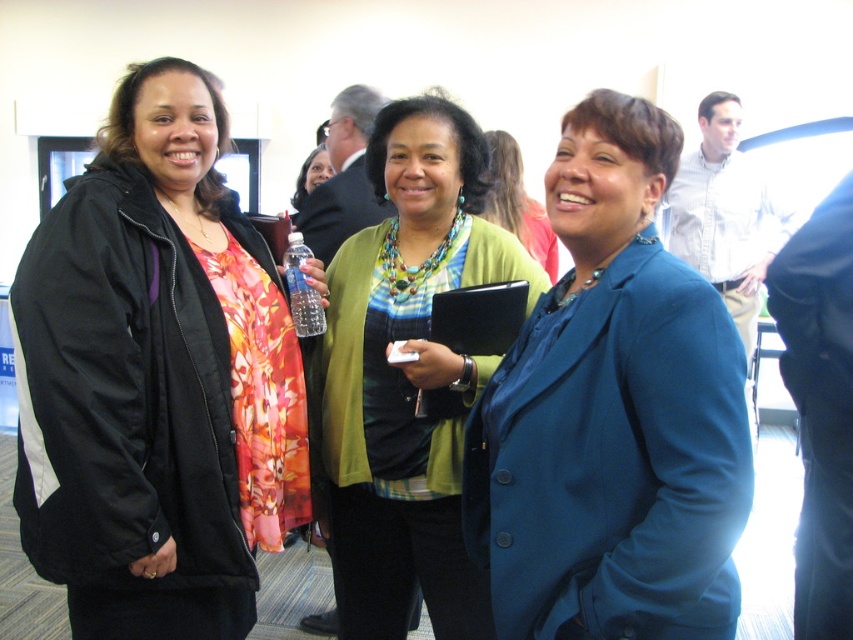
In the scene shown: Who is taller, teal smooth blazer at center or matte green sweater at center?

teal smooth blazer at center is taller.

Does teal smooth blazer at center appear over matte green sweater at center?

Incorrect, teal smooth blazer at center is not positioned above matte green sweater at center.

At what (x,y) coordinates should I click in order to perform the action: click on teal smooth blazer at center. Please return your answer as a coordinate pair (x, y). This screenshot has height=640, width=853. Looking at the image, I should click on (612, 413).

Does teal smooth blazer at center appear under green textured cardigan at center?

No, teal smooth blazer at center is not below green textured cardigan at center.

Is teal smooth blazer at center further to the viewer compared to green textured cardigan at center?

No, it is not.

Between point (540, 616) and point (438, 280), which one is positioned behind?

The point (438, 280) is more distant.

This screenshot has width=853, height=640. Find the location of `teal smooth blazer at center`. teal smooth blazer at center is located at coordinates (612, 413).

Does point (498, 152) come in front of point (293, 269)?

No, it is not.

Is point (497, 150) behind point (294, 310)?

Yes, point (497, 150) is farther from viewer.

Locate an element on the screen. matte green sweater at center is located at coordinates (518, 204).